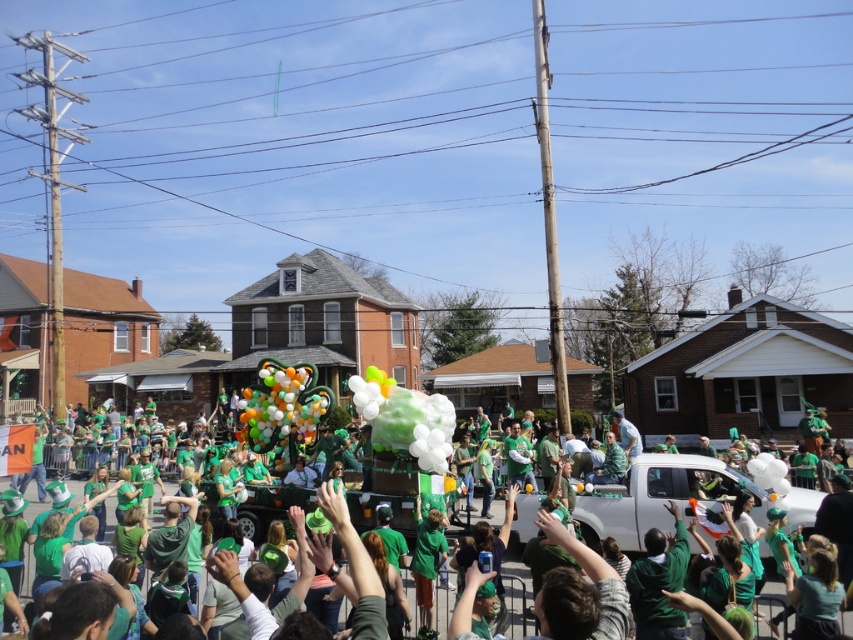
Question: Does green fabric float at center have a lesser width compared to multicolored glossy balloons at center?

Choices:
 (A) no
 (B) yes

Answer: (A)

Question: Can you confirm if translucent green cloud at center is positioned to the right of multicolored glossy balloons at center?

Choices:
 (A) no
 (B) yes

Answer: (B)

Question: Can you confirm if translucent green cloud at center is wider than multicolored glossy balloons at center?

Choices:
 (A) no
 (B) yes

Answer: (B)

Question: Which of the following is the closest to the observer?

Choices:
 (A) (421, 410)
 (B) (310, 397)

Answer: (A)

Question: Which point is closer to the camera taking this photo?

Choices:
 (A) (630, 513)
 (B) (422, 436)

Answer: (A)

Question: Which object is positioned farthest from the multicolored glossy balloons at center?

Choices:
 (A) translucent green cloud at center
 (B) green fabric float at center

Answer: (B)